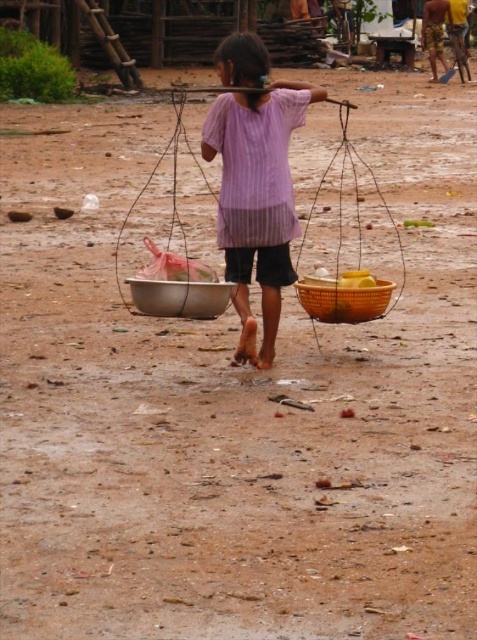
The young girl in the rural scene is wearing a purple striped shirt at center and carrying a bright yellow woven basket at center. From the perspective of someone looking at her directly, which item is closer to the viewer?

The purple striped shirt at center is closer to the viewer because it is in front of the bright yellow woven basket at center.

The girl is wearing a purple striped shirt at center and has a metallic silver bowl at center. Which item is higher up from the ground?

The purple striped shirt at center is above the metallic silver bowl at center, so the purple striped shirt at center is higher up from the ground.